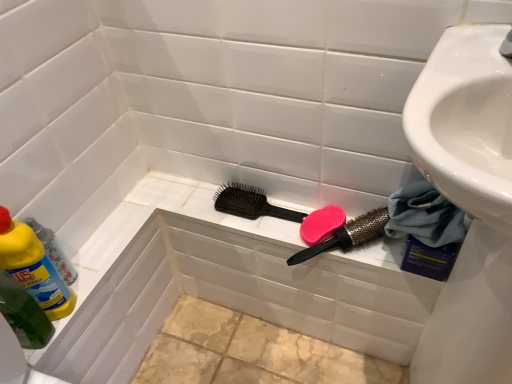
Where is `free space to the left of black plastic hairbrush at center, the first brush when ordered from left to right`? The width and height of the screenshot is (512, 384). free space to the left of black plastic hairbrush at center, the first brush when ordered from left to right is located at coordinates (195, 196).